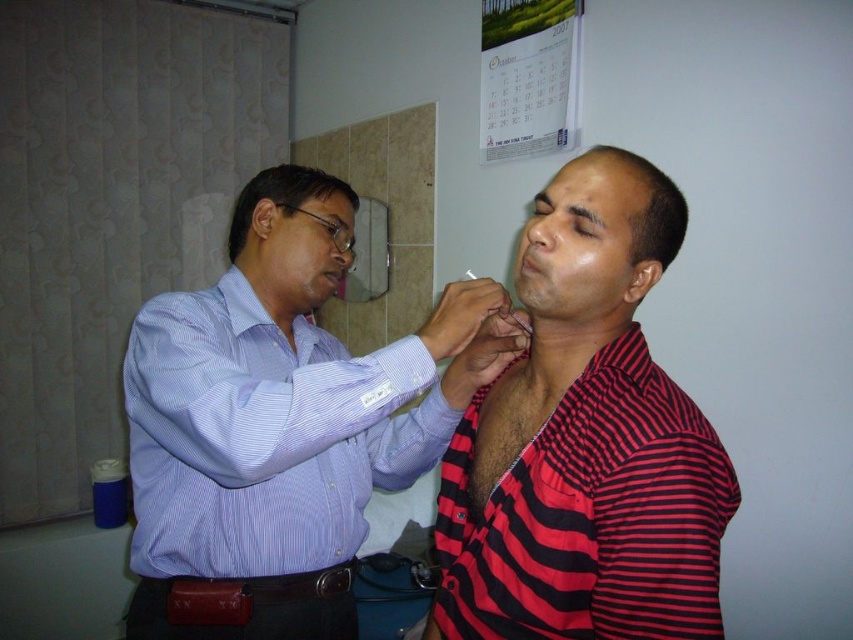
Question: Which point is closer to the camera?

Choices:
 (A) blue striped shirt at upper left
 (B) red striped shirt at center

Answer: (B)

Question: Observing the image, what is the correct spatial positioning of blue striped shirt at upper left in reference to red striped shirt at center?

Choices:
 (A) left
 (B) right

Answer: (A)

Question: Does blue striped shirt at upper left lie behind red striped shirt at center?

Choices:
 (A) yes
 (B) no

Answer: (A)

Question: Which point is farther to the camera?

Choices:
 (A) red striped shirt at center
 (B) blue striped shirt at upper left

Answer: (B)

Question: Can you confirm if blue striped shirt at upper left is thinner than red striped shirt at center?

Choices:
 (A) yes
 (B) no

Answer: (B)